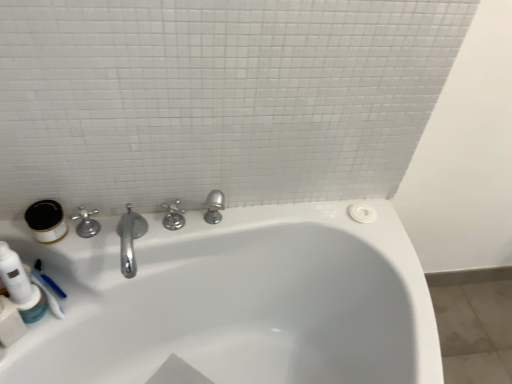
Question: Does polished chrome faucet at left, placed as the 2th tap when sorted from right to left, have a smaller size compared to white glossy bathtub at center?

Choices:
 (A) no
 (B) yes

Answer: (B)

Question: Is polished chrome faucet at left, which ranks as the first tap in left-to-right order, to the right of white glossy bathtub at center from the viewer's perspective?

Choices:
 (A) yes
 (B) no

Answer: (B)

Question: Are polished chrome faucet at left, placed as the 2th tap when sorted from right to left, and white glossy bathtub at center making contact?

Choices:
 (A) no
 (B) yes

Answer: (A)

Question: Is polished chrome faucet at left, placed as the 2th tap when sorted from right to left, closer to the viewer compared to white glossy bathtub at center?

Choices:
 (A) no
 (B) yes

Answer: (A)

Question: Does polished chrome faucet at left, which ranks as the first tap in left-to-right order, turn towards white glossy bathtub at center?

Choices:
 (A) no
 (B) yes

Answer: (A)

Question: Would you say polished chrome faucet at center, which is counted as the 2th tap, starting from the left, is inside or outside matte white jar at left, the 2th mouthwash positioned from the bottom?

Choices:
 (A) outside
 (B) inside

Answer: (A)

Question: From a real-world perspective, relative to matte white jar at left, the 2th mouthwash positioned from the bottom, is polished chrome faucet at center, which is counted as the 2th tap, starting from the left, vertically above or below?

Choices:
 (A) below
 (B) above

Answer: (A)

Question: Based on their positions, is polished chrome faucet at center, which is counted as the 2th tap, starting from the left, located to the left or right of matte white jar at left, the 1th mouthwash positioned from the top?

Choices:
 (A) right
 (B) left

Answer: (A)

Question: Is point (181, 213) closer or farther from the camera than point (31, 208)?

Choices:
 (A) farther
 (B) closer

Answer: (A)

Question: Would you say translucent plastic mouthwash at lower left, which ranks as the 1th mouthwash in bottom-to-top order, is inside or outside polished chrome faucet at left, which ranks as the first tap in left-to-right order?

Choices:
 (A) outside
 (B) inside

Answer: (A)

Question: In terms of height, does translucent plastic mouthwash at lower left, which ranks as the 1th mouthwash in bottom-to-top order, look taller or shorter compared to polished chrome faucet at left, placed as the 2th tap when sorted from right to left?

Choices:
 (A) tall
 (B) short

Answer: (B)

Question: From a real-world perspective, relative to polished chrome faucet at left, which ranks as the first tap in left-to-right order, is translucent plastic mouthwash at lower left, which ranks as the 1th mouthwash in bottom-to-top order, vertically above or below?

Choices:
 (A) below
 (B) above

Answer: (A)

Question: Considering their positions, is translucent plastic mouthwash at lower left, which ranks as the 1th mouthwash in bottom-to-top order, located in front of or behind polished chrome faucet at left, which ranks as the first tap in left-to-right order?

Choices:
 (A) behind
 (B) front

Answer: (B)

Question: From their relative heights in the image, would you say white glossy bathtub at center is taller or shorter than polished chrome faucet at left, placed as the 2th tap when sorted from right to left?

Choices:
 (A) short
 (B) tall

Answer: (B)

Question: Does point (382, 349) appear closer or farther from the camera than point (92, 235)?

Choices:
 (A) closer
 (B) farther

Answer: (A)